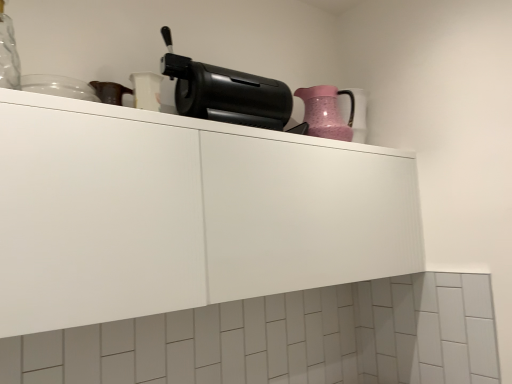
I want to click on white matte cabinet at upper center, so click(184, 213).

Considering the sizes of objects white matte cabinet at upper center and pink textured pitcher at upper right in the image provided, who is shorter, white matte cabinet at upper center or pink textured pitcher at upper right?

Standing shorter between the two is pink textured pitcher at upper right.

You are a GUI agent. You are given a task and a screenshot of the screen. Output one action in this format:
    pyautogui.click(x=<x>, y=<y>)
    Task: Click on the kitchen appliance above the white matte cabinet at upper center (from a real-world perspective)
    This screenshot has height=384, width=512.
    Given the screenshot: What is the action you would take?
    pyautogui.click(x=326, y=112)

From the image's perspective, is white matte cabinet at upper center on pink textured pitcher at upper right?

Actually, white matte cabinet at upper center appears below pink textured pitcher at upper right in the image.

Which is behind, point (189, 167) or point (340, 129)?

The point (340, 129) is farther.

Is white matte cabinet at upper center aimed at black plastic coffee maker at upper center?

No, white matte cabinet at upper center is not facing towards black plastic coffee maker at upper center.

Based on their positions, is white matte cabinet at upper center located to the left or right of black plastic coffee maker at upper center?

Clearly, white matte cabinet at upper center is on the right of black plastic coffee maker at upper center in the image.

Considering the positions of point (147, 189) and point (277, 120), is point (147, 189) closer or farther from the camera than point (277, 120)?

Point (147, 189).

I want to click on cabinetry in front of the black plastic coffee maker at upper center, so pyautogui.click(x=184, y=213).

Which is in front, pink textured pitcher at upper right or white matte cabinet at upper center?

Positioned in front is white matte cabinet at upper center.

Locate an element on the screen. The height and width of the screenshot is (384, 512). kitchen appliance to the right of white matte cabinet at upper center is located at coordinates (326, 112).

Considering the relative sizes of pink textured pitcher at upper right and white matte cabinet at upper center in the image provided, is pink textured pitcher at upper right shorter than white matte cabinet at upper center?

Yes, pink textured pitcher at upper right is shorter than white matte cabinet at upper center.

Can you confirm if black plastic coffee maker at upper center is positioned to the right of pink textured pitcher at upper right?

No, black plastic coffee maker at upper center is not to the right of pink textured pitcher at upper right.

Consider the image. How different are the orientations of black plastic coffee maker at upper center and pink textured pitcher at upper right in degrees?

0.000207 degrees separate the facing orientations of black plastic coffee maker at upper center and pink textured pitcher at upper right.

Is black plastic coffee maker at upper center wider than pink textured pitcher at upper right?

Incorrect, the width of black plastic coffee maker at upper center does not surpass that of pink textured pitcher at upper right.

Image resolution: width=512 pixels, height=384 pixels. What are the coordinates of `home appliance above the pink textured pitcher at upper right (from the image's perspective)` in the screenshot? It's located at (225, 92).

Is black plastic coffee maker at upper center positioned in front of white matte cabinet at upper center?

No, black plastic coffee maker at upper center is behind white matte cabinet at upper center.

Considering the relative sizes of black plastic coffee maker at upper center and white matte cabinet at upper center in the image provided, is black plastic coffee maker at upper center wider than white matte cabinet at upper center?

In fact, black plastic coffee maker at upper center might be narrower than white matte cabinet at upper center.

How different are the orientations of black plastic coffee maker at upper center and white matte cabinet at upper center in degrees?

0.299 degrees.

Could you measure the distance between black plastic coffee maker at upper center and white matte cabinet at upper center?

The distance of black plastic coffee maker at upper center from white matte cabinet at upper center is 14.69 inches.

From a real-world perspective, relative to black plastic coffee maker at upper center, is pink textured pitcher at upper right vertically above or below?

Clearly, from a real-world perspective, pink textured pitcher at upper right is below black plastic coffee maker at upper center.

Does point (322, 92) lie behind point (230, 120)?

Yes, it is behind point (230, 120).

In the image, is pink textured pitcher at upper right positioned in front of or behind black plastic coffee maker at upper center?

pink textured pitcher at upper right is behind black plastic coffee maker at upper center.

Is pink textured pitcher at upper right facing towards black plastic coffee maker at upper center?

No, pink textured pitcher at upper right does not turn towards black plastic coffee maker at upper center.

This screenshot has height=384, width=512. Find the location of `kitchen appliance above the white matte cabinet at upper center (from a real-world perspective)`. kitchen appliance above the white matte cabinet at upper center (from a real-world perspective) is located at coordinates (326, 112).

What are the coordinates of `cabinetry that appears on the right of black plastic coffee maker at upper center` in the screenshot? It's located at (184, 213).

In the scene shown: Considering their positions, is pink textured pitcher at upper right positioned further to white matte cabinet at upper center than black plastic coffee maker at upper center?

pink textured pitcher at upper right is further to white matte cabinet at upper center.

When comparing their distances from pink textured pitcher at upper right, does white matte cabinet at upper center or black plastic coffee maker at upper center seem further?

Among the two, white matte cabinet at upper center is located further to pink textured pitcher at upper right.

When comparing their distances from black plastic coffee maker at upper center, does pink textured pitcher at upper right or white matte cabinet at upper center seem further?

white matte cabinet at upper center is positioned further to the anchor black plastic coffee maker at upper center.

Looking at this image, estimate the real-world distances between objects in this image. Which object is further from pink textured pitcher at upper right, black plastic coffee maker at upper center or white matte cabinet at upper center?

white matte cabinet at upper center is further to pink textured pitcher at upper right.

Which object lies nearer to the anchor point white matte cabinet at upper center, black plastic coffee maker at upper center or pink textured pitcher at upper right?

black plastic coffee maker at upper center lies closer to white matte cabinet at upper center than the other object.

When comparing their distances from black plastic coffee maker at upper center, does white matte cabinet at upper center or pink textured pitcher at upper right seem closer?

Among the two, pink textured pitcher at upper right is located nearer to black plastic coffee maker at upper center.

This screenshot has height=384, width=512. In order to click on home appliance between white matte cabinet at upper center and pink textured pitcher at upper right along the z-axis in this screenshot , I will do `click(225, 92)`.